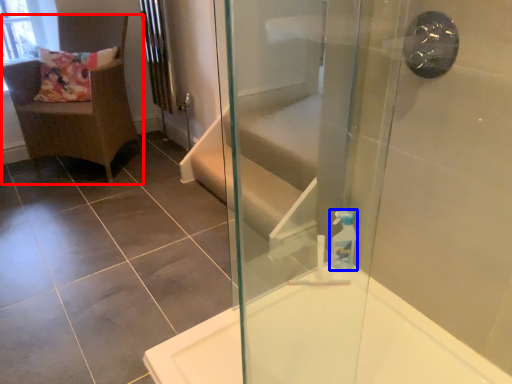
Question: Which point is further to the camera, chair (highlighted by a red box) or soap dispenser (highlighted by a blue box)?

Choices:
 (A) chair
 (B) soap dispenser

Answer: (A)